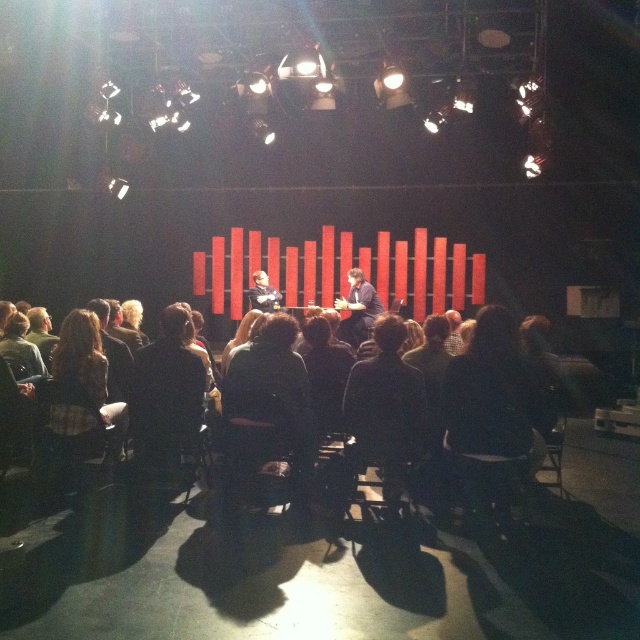
From the picture: Is dark brown leather jacket at center closer to the viewer compared to smooth black jacket at center?

Yes, it is in front of smooth black jacket at center.

Between dark brown leather jacket at center and smooth black jacket at center, which one is positioned higher?

Positioned higher is smooth black jacket at center.

Image resolution: width=640 pixels, height=640 pixels. Describe the element at coordinates (358, 308) in the screenshot. I see `dark brown leather jacket at center` at that location.

Identify the location of dark brown leather jacket at center. The width and height of the screenshot is (640, 640). (358, 308).

Who is more forward, (490, 371) or (100, 374)?

Point (490, 371) is more forward.

In the scene shown: Between black fabric chair at lower center and dark brown hair at center, which one is positioned lower?

black fabric chair at lower center is below.

The image size is (640, 640). What do you see at coordinates (492, 394) in the screenshot? I see `black fabric chair at lower center` at bounding box center [492, 394].

Identify the location of black fabric chair at lower center. (492, 394).

Is dark brown hair at center smaller than matte black chair at center?

Yes, dark brown hair at center is smaller than matte black chair at center.

Locate an element on the screen. The width and height of the screenshot is (640, 640). dark brown hair at center is located at coordinates (83, 388).

Is point (81, 333) positioned behind point (560, 481)?

No, (81, 333) is closer to viewer.

I want to click on dark brown hair at center, so click(x=83, y=388).